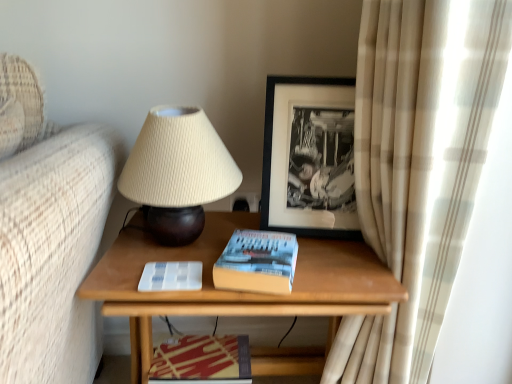
This screenshot has height=384, width=512. In order to click on free spot above red glossy magazine at lower center (from a real-world perspective) in this screenshot , I will do `click(206, 352)`.